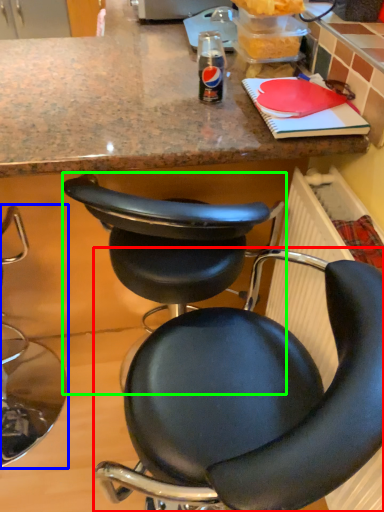
Question: Which object is positioned farthest from chair (highlighted by a red box)? Select from chair (highlighted by a blue box) and chair (highlighted by a green box).

Choices:
 (A) chair
 (B) chair

Answer: (A)